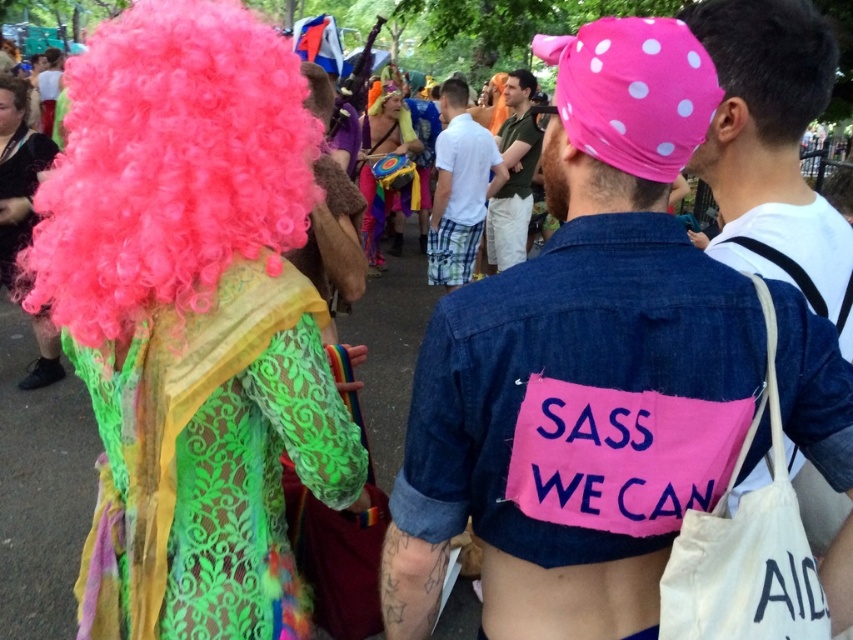
Question: Which of the following is the farthest from the observer?

Choices:
 (A) (753, 56)
 (B) (44, 348)

Answer: (B)

Question: Which object appears closest to the camera in this image?

Choices:
 (A) fluffy pink wig at upper left
 (B) brown curly hair at center
 (C) brown curly hair at upper center
 (D) white cotton shirt at center

Answer: (A)

Question: Can you confirm if neon pink wig at center is bigger than brown curly hair at upper center?

Choices:
 (A) no
 (B) yes

Answer: (B)

Question: Which object is the farthest from the brown curly hair at center?

Choices:
 (A) neon green lace wig at upper left
 (B) pink curly wig at upper left
 (C) denim jacket at center

Answer: (C)

Question: Does black smooth hair at upper center appear on the right side of matte white shirt at upper left?

Choices:
 (A) no
 (B) yes

Answer: (B)

Question: Is neon green lace wig at upper left wider than green matte shirt at center?

Choices:
 (A) yes
 (B) no

Answer: (A)